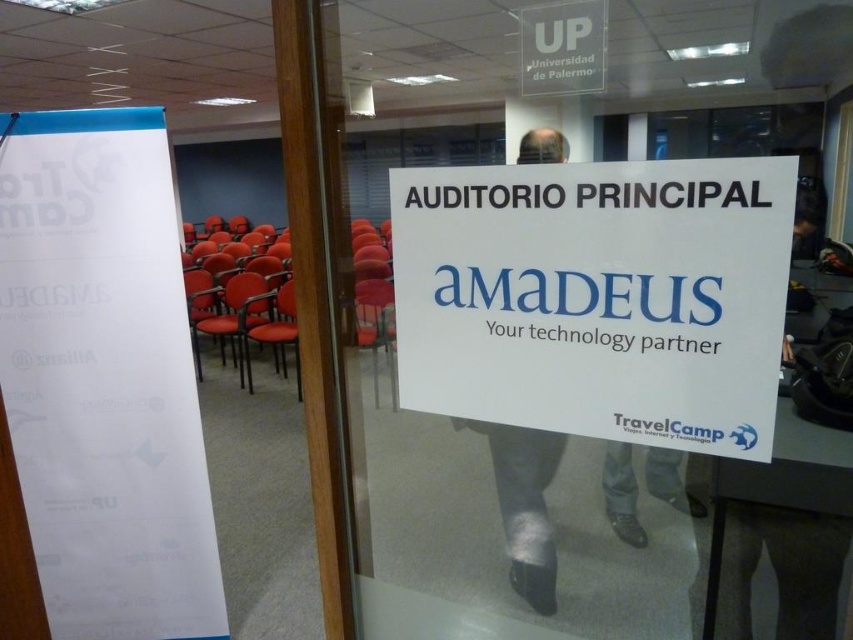
Which of these two, transparent glass door at upper center or white paper sign at center, stands taller?

Standing taller between the two is transparent glass door at upper center.

What do you see at coordinates (563, 385) in the screenshot? I see `transparent glass door at upper center` at bounding box center [563, 385].

Does point (496, 349) come in front of point (660, 170)?

No, it is not.

Image resolution: width=853 pixels, height=640 pixels. Find the location of `transparent glass door at upper center`. transparent glass door at upper center is located at coordinates (563, 385).

Can you confirm if white paper sign at center is shorter than white paper at left?

Yes, white paper sign at center is shorter than white paper at left.

Is point (712, 442) closer to viewer compared to point (83, 584)?

Yes, point (712, 442) is closer to viewer.

The width and height of the screenshot is (853, 640). What are the coordinates of `white paper sign at center` in the screenshot? It's located at pos(596,298).

Looking at this image, who is shorter, transparent glass door at upper center or white paper at left?

transparent glass door at upper center

Does transparent glass door at upper center come in front of white paper at left?

No, it is behind white paper at left.

What do you see at coordinates (563, 385) in the screenshot? I see `transparent glass door at upper center` at bounding box center [563, 385].

You are a GUI agent. You are given a task and a screenshot of the screen. Output one action in this format:
    pyautogui.click(x=<x>, y=<y>)
    Task: Click on the transparent glass door at upper center
    
    Given the screenshot: What is the action you would take?
    pyautogui.click(x=563, y=385)